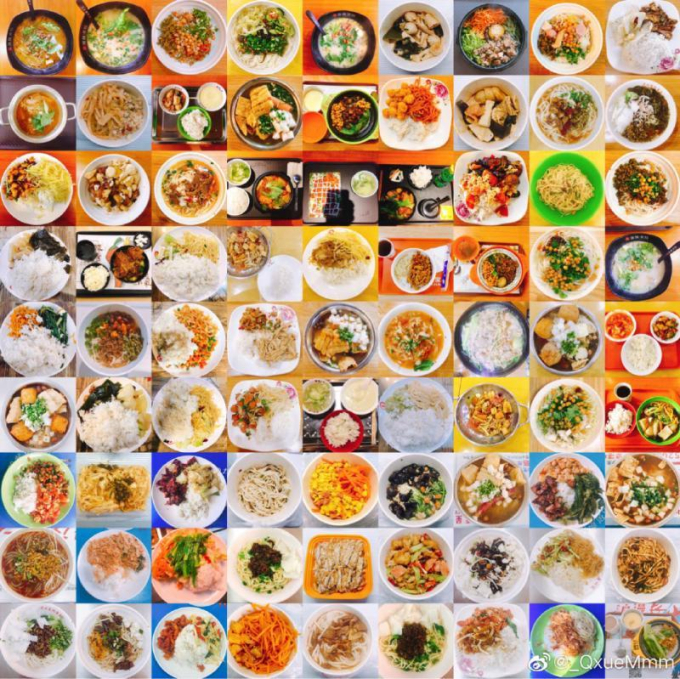
The height and width of the screenshot is (679, 680). I want to click on the top row of photographs, so click(x=45, y=41), click(x=116, y=41), click(x=181, y=41), click(x=258, y=41), click(x=341, y=43), click(x=422, y=39), click(x=494, y=39), click(x=570, y=39), click(x=644, y=43).